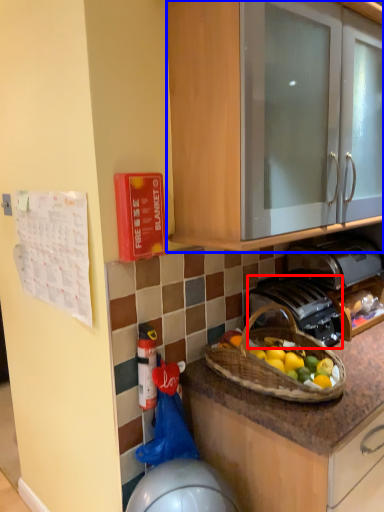
Question: Which of the following is the closest to the observer, gas stove (highlighted by a red box) or cabinetry (highlighted by a blue box)?

Choices:
 (A) gas stove
 (B) cabinetry

Answer: (B)